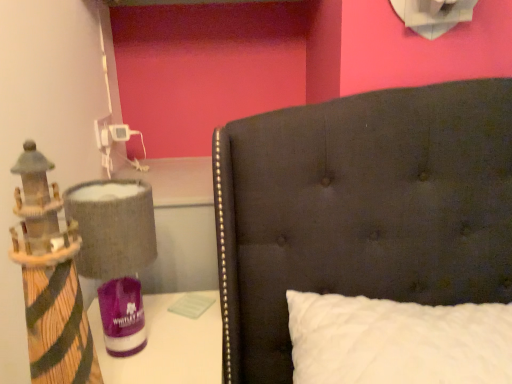
This screenshot has width=512, height=384. What do you see at coordinates (116, 254) in the screenshot? I see `textured fabric lampshade at left` at bounding box center [116, 254].

You are a GUI agent. You are given a task and a screenshot of the screen. Output one action in this format:
    pyautogui.click(x=<x>, y=<y>)
    Task: Click on the white quilted pillow at center
    
    Given the screenshot: What is the action you would take?
    pos(397,341)

Does textured fabric lampshade at left appear on the left side of wooden lighthouse at left?

No.

From the picture: In the image, is textured fabric lampshade at left positioned in front of or behind wooden lighthouse at left?

Visually, textured fabric lampshade at left is located behind wooden lighthouse at left.

Do you think textured fabric lampshade at left is within wooden lighthouse at left, or outside of it?

textured fabric lampshade at left is located beyond the bounds of wooden lighthouse at left.

Considering the relative positions of wooden lighthouse at left and white quilted pillow at center in the image provided, is wooden lighthouse at left in front of white quilted pillow at center?

Yes.

Where is `pillow on the right side of wooden lighthouse at left`? The width and height of the screenshot is (512, 384). pillow on the right side of wooden lighthouse at left is located at coordinates (397, 341).

At what (x,y) coordinates should I click in order to perform the action: click on toy on the left of textured fabric lampshade at left. Please return your answer as a coordinate pair (x, y). This screenshot has height=384, width=512. Looking at the image, I should click on (50, 280).

Is wooden lighthouse at left facing away from textured fabric lampshade at left?

Yes, wooden lighthouse at left's orientation is away from textured fabric lampshade at left.

Is wooden lighthouse at left inside or outside of textured fabric lampshade at left?

wooden lighthouse at left is not inside textured fabric lampshade at left, it's outside.

Does wooden lighthouse at left touch textured fabric lampshade at left?

No, wooden lighthouse at left is not in contact with textured fabric lampshade at left.

Which of these two, white quilted pillow at center or wooden lighthouse at left, stands taller?

With more height is white quilted pillow at center.

Consider the image. Is white quilted pillow at center positioned far away from wooden lighthouse at left?

No, there isn't a large distance between white quilted pillow at center and wooden lighthouse at left.

What's the angular difference between white quilted pillow at center and wooden lighthouse at left's facing directions?

The facing directions of white quilted pillow at center and wooden lighthouse at left are 1.35 degrees apart.

Considering the positions of objects white quilted pillow at center and wooden lighthouse at left in the image provided, who is in front, white quilted pillow at center or wooden lighthouse at left?

wooden lighthouse at left is more forward.

Which point is more forward, (101, 219) or (331, 295)?

The point (101, 219) is in front.

Does textured fabric lampshade at left come behind white quilted pillow at center?

Yes, textured fabric lampshade at left is further from the viewer.

Consider the image. Based on their sizes in the image, would you say textured fabric lampshade at left is bigger or smaller than white quilted pillow at center?

Clearly, textured fabric lampshade at left is smaller in size than white quilted pillow at center.

Is textured fabric lampshade at left wider than white quilted pillow at center?

In fact, textured fabric lampshade at left might be narrower than white quilted pillow at center.

Considering the relative sizes of white quilted pillow at center and textured fabric lampshade at left in the image provided, is white quilted pillow at center wider than textured fabric lampshade at left?

A: Yes.

Considering the sizes of white quilted pillow at center and textured fabric lampshade at left in the image, is white quilted pillow at center taller or shorter than textured fabric lampshade at left?

Clearly, white quilted pillow at center is taller compared to textured fabric lampshade at left.

Based on the photo, is white quilted pillow at center not inside textured fabric lampshade at left?

Yes, white quilted pillow at center is not within textured fabric lampshade at left.

Considering the relative positions of white quilted pillow at center and textured fabric lampshade at left in the image provided, is white quilted pillow at center to the left of textured fabric lampshade at left from the viewer's perspective?

No.

Locate an element on the screen. Image resolution: width=512 pixels, height=384 pixels. table lamp below the wooden lighthouse at left (from the image's perspective) is located at coordinates (116, 254).

I want to click on pillow behind the wooden lighthouse at left, so click(x=397, y=341).

Considering their positions, is textured fabric lampshade at left positioned further to white quilted pillow at center than wooden lighthouse at left?

Among the two, wooden lighthouse at left is located further to white quilted pillow at center.

When comparing their distances from white quilted pillow at center, does wooden lighthouse at left or textured fabric lampshade at left seem closer?

Among the two, textured fabric lampshade at left is located nearer to white quilted pillow at center.

When comparing their distances from textured fabric lampshade at left, does wooden lighthouse at left or white quilted pillow at center seem further?

white quilted pillow at center is positioned further to the anchor textured fabric lampshade at left.

Based on their spatial positions, is textured fabric lampshade at left or white quilted pillow at center closer to wooden lighthouse at left?

textured fabric lampshade at left is positioned closer to the anchor wooden lighthouse at left.

Estimate the real-world distances between objects in this image. Which object is closer to wooden lighthouse at left, white quilted pillow at center or textured fabric lampshade at left?

Based on the image, textured fabric lampshade at left appears to be nearer to wooden lighthouse at left.

From the image, which object appears to be nearer to textured fabric lampshade at left, white quilted pillow at center or wooden lighthouse at left?

Among the two, wooden lighthouse at left is located nearer to textured fabric lampshade at left.

What are the coordinates of `table lamp between wooden lighthouse at left and white quilted pillow at center from left to right` in the screenshot? It's located at (116, 254).